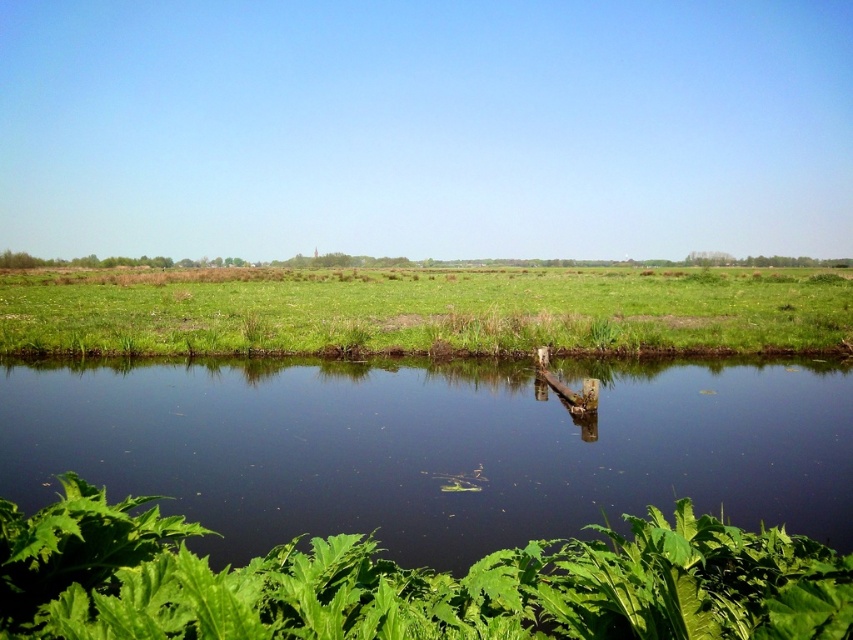
You are standing at the edge of the water and want to walk towards the green grass at center. Which direction should you head to avoid the green leafy plants at lower center?

The green leafy plants at lower center are located below the green grass at center, so to avoid them, you should head upwards towards the green grass at center rather than moving downward where the green leafy plants at lower center are situated.

You are standing at the edge of the water in the rural landscape and want to reach the green grass at center. There is a green leafy plant at lower center blocking your path. Can you walk around it if you have a 40 meter distance available?

The green leafy plant at lower center is 39.03 meters from the green grass at center. Since you have a 40 meter distance available, you can walk around it as the required distance is slightly less than what you have.